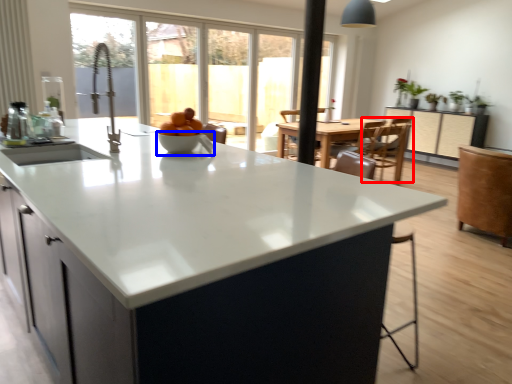
Question: Which of the following is the farthest to the observer, armchair (highlighted by a red box) or bowl (highlighted by a blue box)?

Choices:
 (A) armchair
 (B) bowl

Answer: (A)